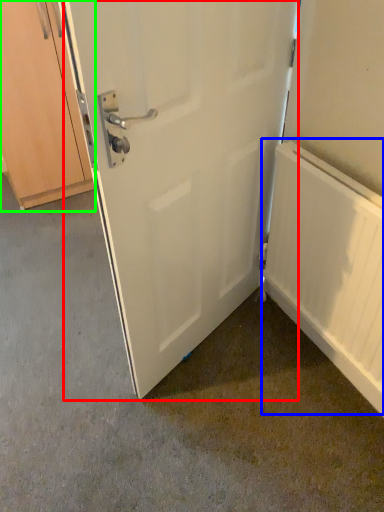
Question: Based on their relative distances, which object is farther from door (highlighted by a red box)? Choose from radiator (highlighted by a blue box) and cabinetry (highlighted by a green box).

Choices:
 (A) radiator
 (B) cabinetry

Answer: (B)